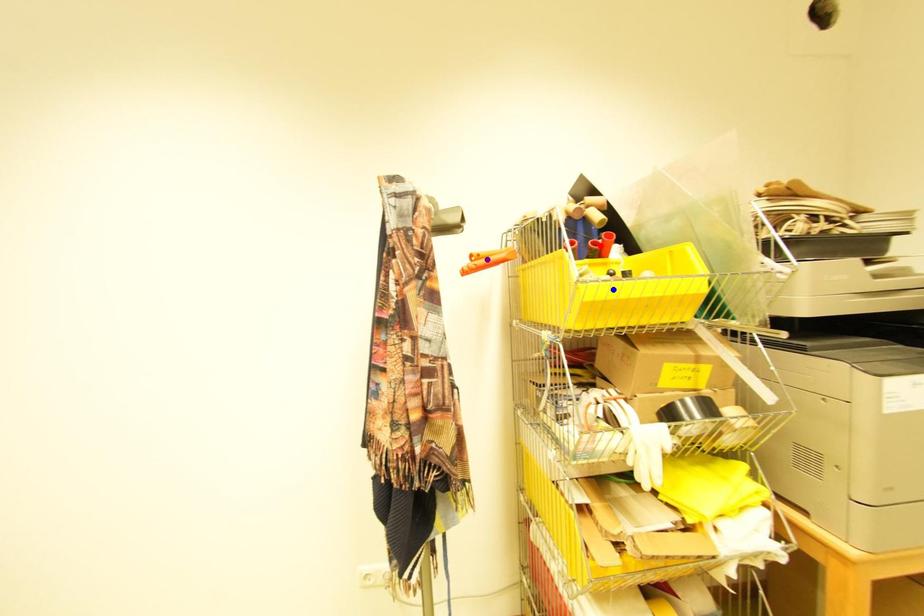
Order these from nearest to farthest:
red point, purple point, blue point

blue point, purple point, red point